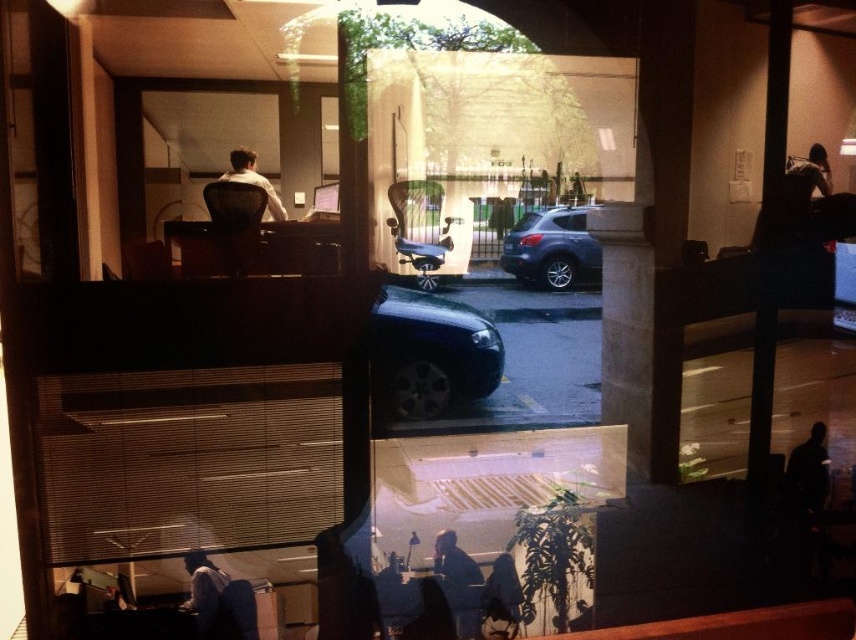
Question: Is satin silver suv at center positioned before dark brown leather jacket at upper right?

Choices:
 (A) no
 (B) yes

Answer: (B)

Question: Is glossy black car at center further to the viewer compared to silhouette figure at lower right?

Choices:
 (A) yes
 (B) no

Answer: (B)

Question: Which point is farther to the camera?

Choices:
 (A) (539, 282)
 (B) (397, 298)

Answer: (A)

Question: Considering the real-world distances, which object is closest to the glossy black car at center?

Choices:
 (A) dark gray shirt at lower left
 (B) matte white shirt at upper center

Answer: (B)

Question: Which is nearer to the glossy black car at center?

Choices:
 (A) satin silver suv at center
 (B) dark blue jacket at lower center
 (C) matte white shirt at upper center
 (D) dark gray shirt at lower left

Answer: (A)

Question: Is satin silver suv at center closer to camera compared to silhouette figure at lower right?

Choices:
 (A) no
 (B) yes

Answer: (B)